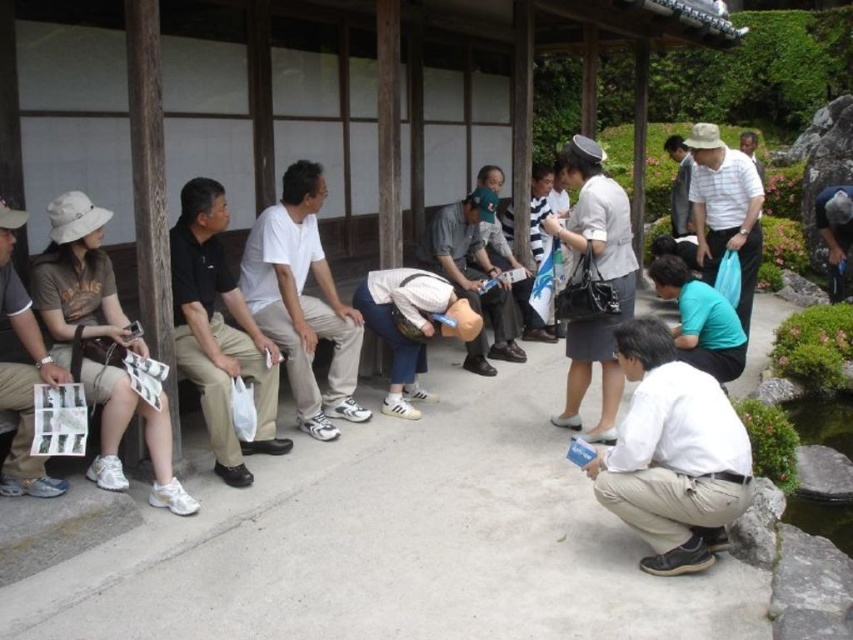
Question: Which object is closer to the camera taking this photo?

Choices:
 (A) white matte shirt at lower right
 (B) white matte cap at center
 (C) teal fabric bag at lower center
 (D) white matte shirt at center

Answer: (A)

Question: Does black cotton shirt at center appear over brown leather mannequin at center?

Choices:
 (A) no
 (B) yes

Answer: (A)

Question: Based on their relative distances, which object is nearer to the white matte shirt at center?

Choices:
 (A) gray fabric skirt at center
 (B) matte brown hat at left
 (C) brown leather mannequin at center
 (D) white matte cap at center

Answer: (D)

Question: Does matte brown hat at left appear on the left side of gray fabric skirt at center?

Choices:
 (A) no
 (B) yes

Answer: (B)

Question: Which object is farther from the camera taking this photo?

Choices:
 (A) matte brown hat at left
 (B) brown leather mannequin at center
 (C) white matte shirt at lower right

Answer: (B)

Question: Does matte brown hat at left have a lesser width compared to black cotton shirt at center?

Choices:
 (A) yes
 (B) no

Answer: (B)